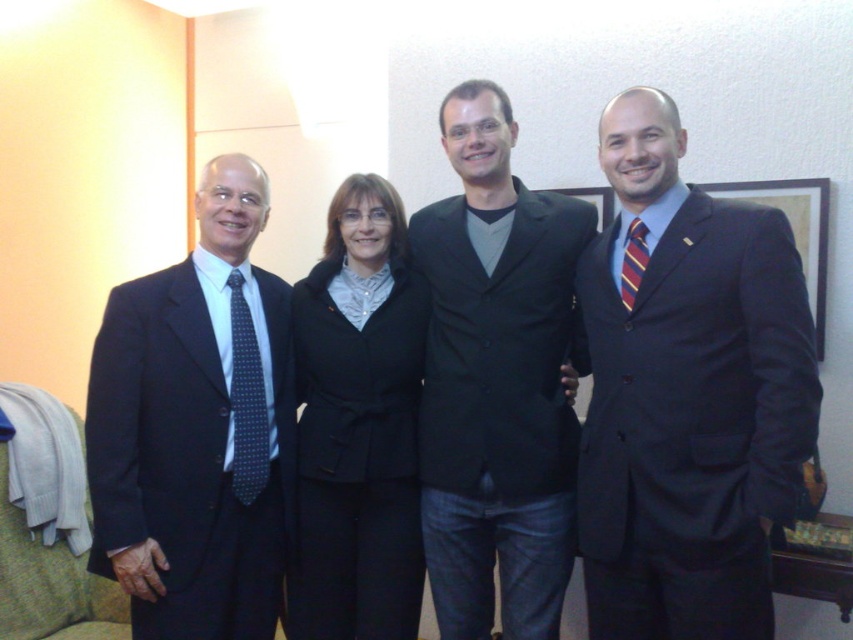
Can you confirm if matte black suit at right is positioned above striped fabric tie at right?

Incorrect, matte black suit at right is not positioned above striped fabric tie at right.

Does matte black suit at right appear under striped fabric tie at right?

Correct, matte black suit at right is located below striped fabric tie at right.

Does point (764, 449) come closer to viewer compared to point (637, 237)?

That is True.

Find the location of a particular element. matte black suit at right is located at coordinates (688, 396).

In the scene shown: Is dark blue dotted tie at left bigger than striped fabric tie at right?

Correct, dark blue dotted tie at left is larger in size than striped fabric tie at right.

Does dark blue dotted tie at left have a lesser height compared to striped fabric tie at right?

Incorrect, dark blue dotted tie at left's height does not fall short of striped fabric tie at right's.

You are a GUI agent. You are given a task and a screenshot of the screen. Output one action in this format:
    pyautogui.click(x=<x>, y=<y>)
    Task: Click on the dark blue dotted tie at left
    This screenshot has width=853, height=640.
    Given the screenshot: What is the action you would take?
    pyautogui.click(x=247, y=401)

Which of these two, black matte blazer at center or black fabric picture frame at center, stands taller?

black matte blazer at center

How far apart are black matte blazer at center and black fabric picture frame at center?

black matte blazer at center and black fabric picture frame at center are 1.07 meters apart.

Between point (347, 449) and point (560, 189), which one is positioned behind?

The point (560, 189) is behind.

You are a GUI agent. You are given a task and a screenshot of the screen. Output one action in this format:
    pyautogui.click(x=<x>, y=<y>)
    Task: Click on the black matte blazer at center
    Image resolution: width=853 pixels, height=640 pixels.
    Given the screenshot: What is the action you would take?
    [x=358, y=426]